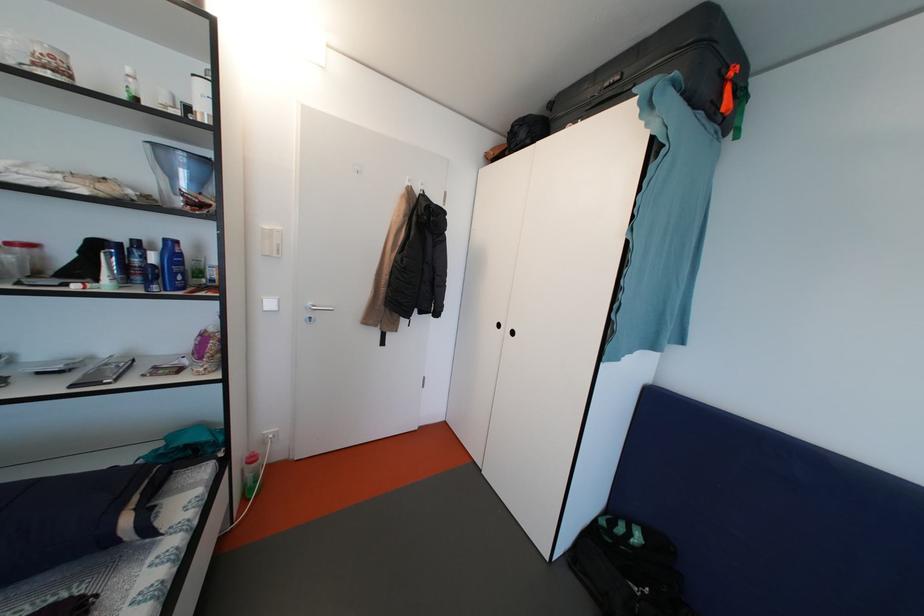
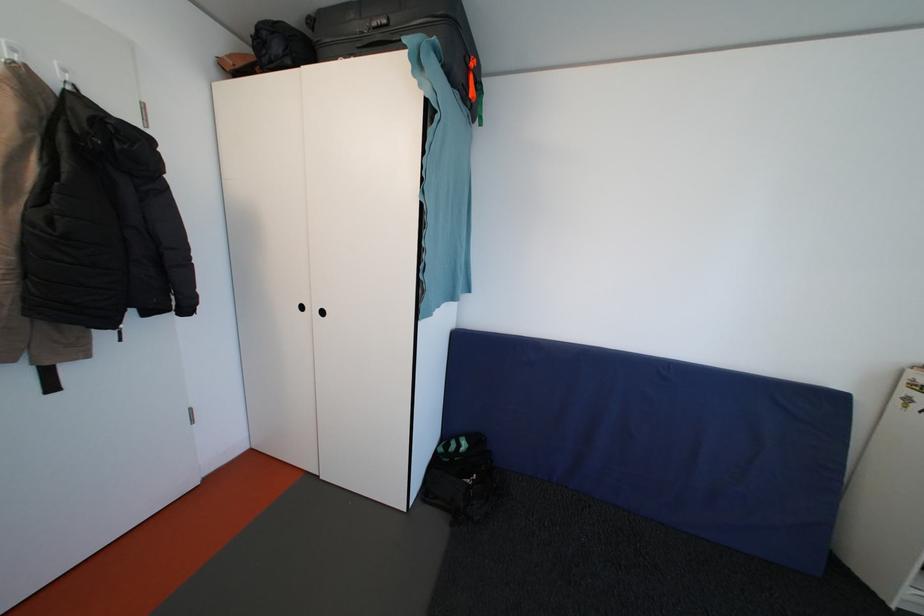
In the second image, find the point that corresponds to pixel 738 79 in the first image.

(479, 70)